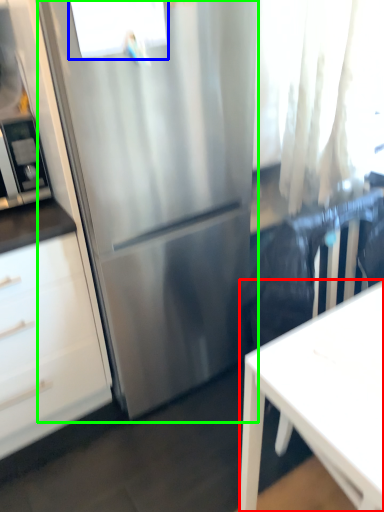
Question: Which object is the farthest from desk (highlighted by a red box)? Choose among these: window (highlighted by a blue box) or refrigerator (highlighted by a green box).

Choices:
 (A) window
 (B) refrigerator

Answer: (A)